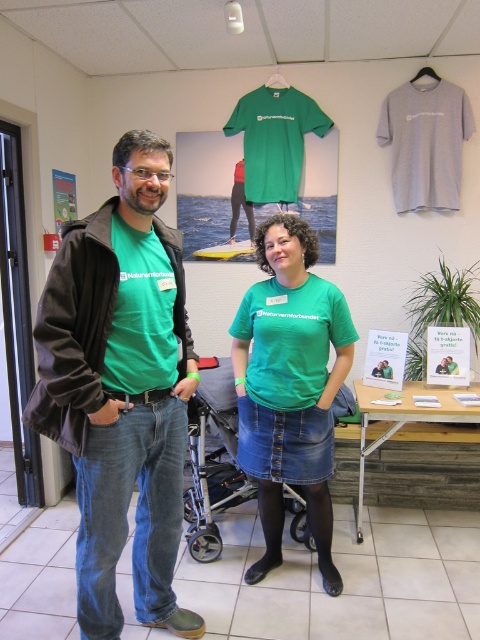
Is green fabric shirt at center shorter than metallic gray baby carriage at center?

No.

Describe the element at coordinates (289, 385) in the screenshot. I see `green fabric shirt at center` at that location.

The image size is (480, 640). I want to click on green fabric shirt at center, so click(x=289, y=385).

In order to click on green fabric shirt at center in this screenshot , I will do `click(289, 385)`.

Does matte green t-shirt at center appear under green fabric shirt at center?

Actually, matte green t-shirt at center is above green fabric shirt at center.

Is matte green t-shirt at center bigger than green fabric shirt at center?

Correct, matte green t-shirt at center is larger in size than green fabric shirt at center.

Who is more distant from viewer, (122, 298) or (256, 403)?

The point (256, 403) is behind.

This screenshot has height=640, width=480. Identify the location of matte green t-shirt at center. (120, 388).

Does matte green t-shirt at center appear on the left side of metallic gray baby carriage at center?

Indeed, matte green t-shirt at center is positioned on the left side of metallic gray baby carriage at center.

This screenshot has width=480, height=640. What do you see at coordinates (120, 388) in the screenshot?
I see `matte green t-shirt at center` at bounding box center [120, 388].

Is point (163, 541) positioned in front of point (188, 538)?

That is True.

You are a GUI agent. You are given a task and a screenshot of the screen. Output one action in this format:
    pyautogui.click(x=<x>, y=<y>)
    Task: Click on the matte green t-shirt at center
    The height and width of the screenshot is (640, 480).
    Given the screenshot: What is the action you would take?
    pyautogui.click(x=120, y=388)